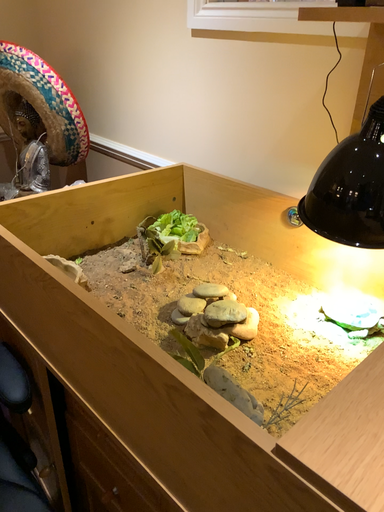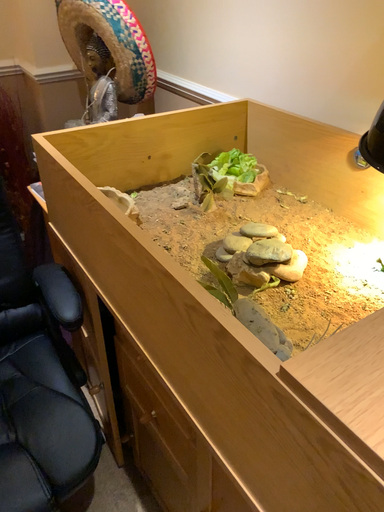
Question: Which way did the camera rotate in the video?

Choices:
 (A) rotated right
 (B) rotated left

Answer: (B)